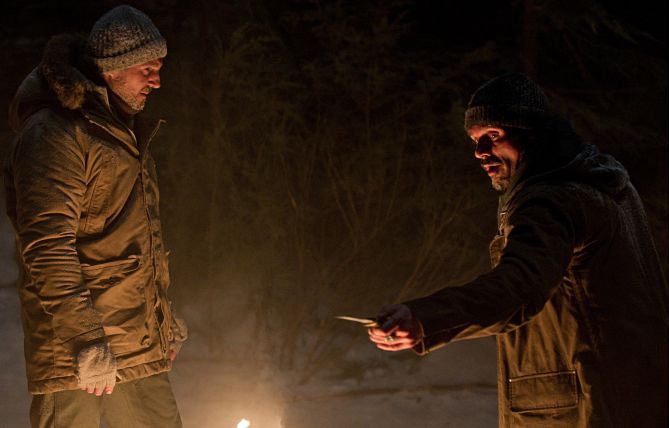
What are the coordinates of `light` in the screenshot? It's located at (249, 414).